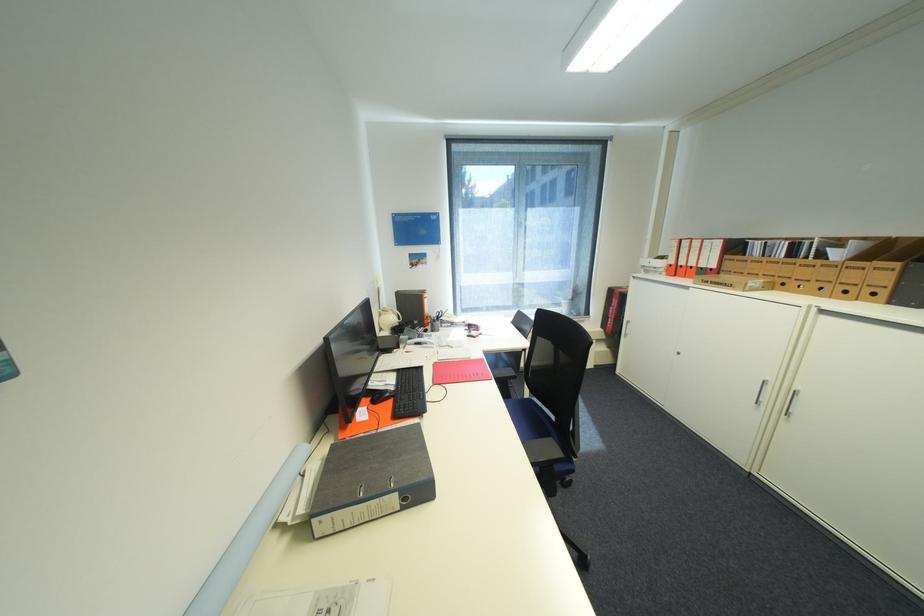
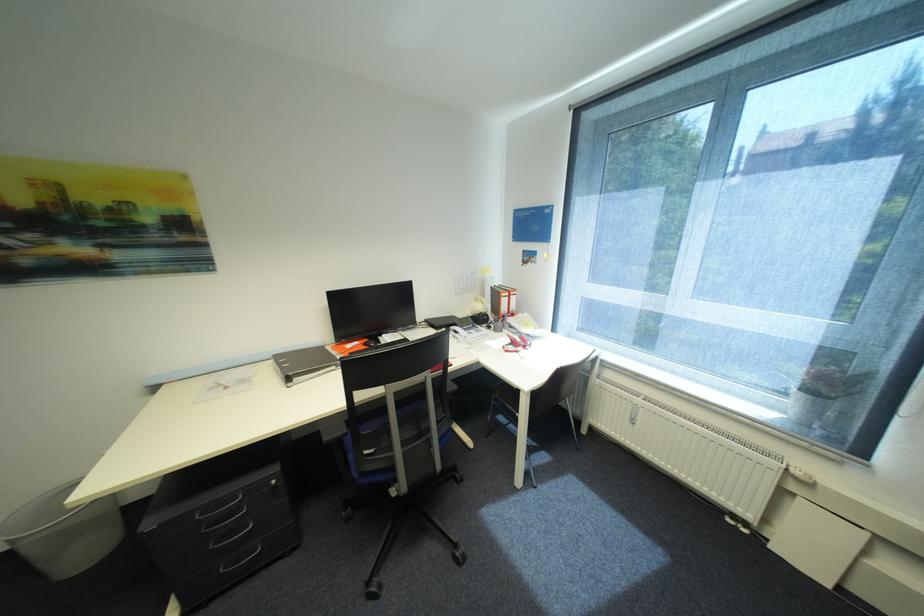
Find the pixel in the second image that matches (456,328) in the first image.

(521, 333)